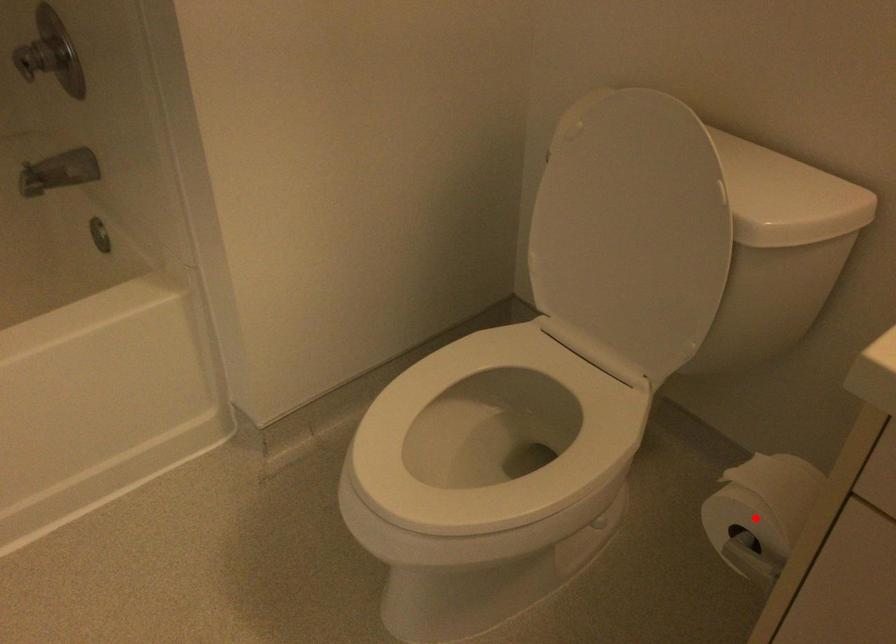
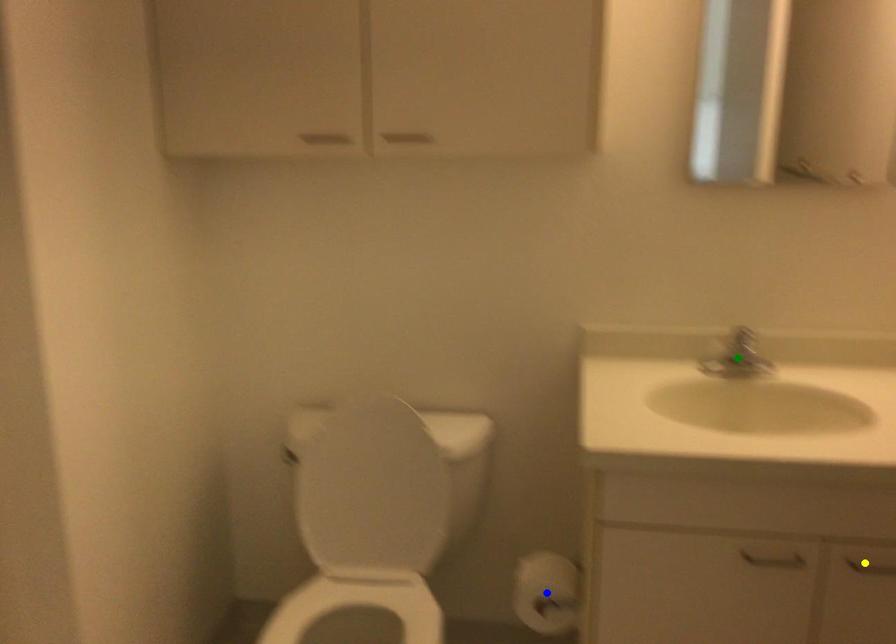
Question: I am providing you with two images of the same scene from different viewpoints. A red point is marked on the first image. You are given multiple points on the second image. Which mark in image 2 goes with the point in image 1?

Choices:
 (A) blue point
 (B) green point
 (C) yellow point

Answer: (A)